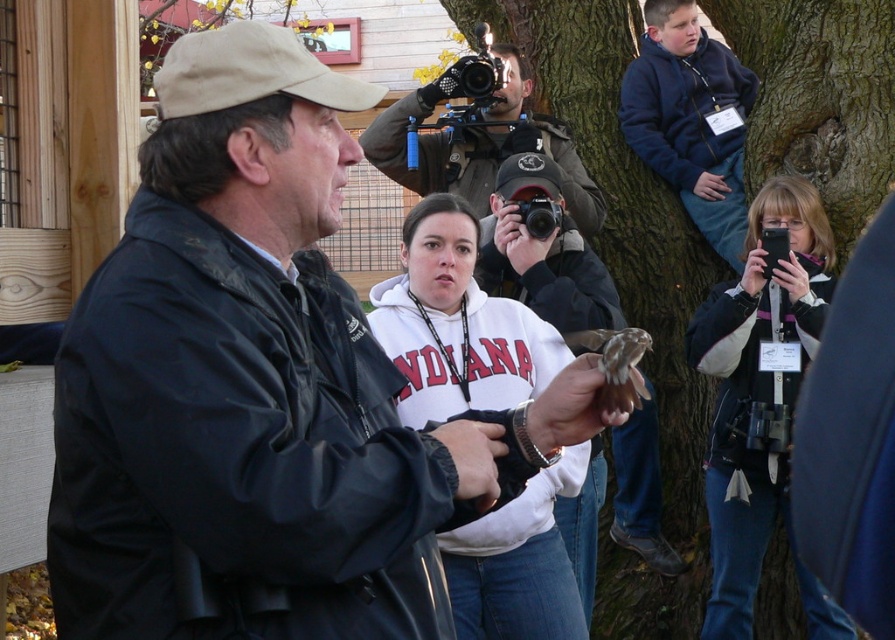
Which is more to the left, white fleece sweatshirt at center or matte brown jacket at center?

white fleece sweatshirt at center is more to the left.

Who is more forward, [496,572] or [405,120]?

Positioned in front is point [496,572].

This screenshot has width=895, height=640. In order to click on white fleece sweatshirt at center in this screenshot , I will do `click(457, 323)`.

Can you confirm if white fleece sweatshirt at center is smaller than matte black jacket at upper right?

Yes.

Between white fleece sweatshirt at center and matte black jacket at upper right, which one appears on the right side from the viewer's perspective?

matte black jacket at upper right

Is point (483, 579) less distant than point (723, 515)?

Yes, it is.

Locate an element on the screen. The image size is (895, 640). white fleece sweatshirt at center is located at coordinates (457, 323).

What do you see at coordinates (761, 401) in the screenshot?
I see `matte black jacket at upper right` at bounding box center [761, 401].

Between point (731, 634) and point (394, 156), which one is positioned in front?

Point (731, 634)

In order to click on matte black jacket at upper right in this screenshot , I will do (761, 401).